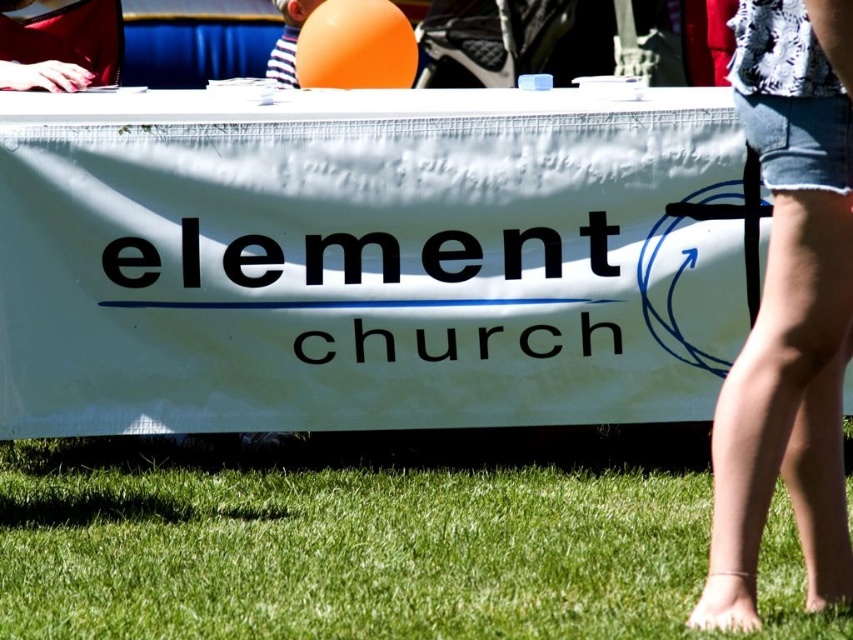
Question: Which point is closer to the camera?

Choices:
 (A) green grass at lower center
 (B) denim shorts at lower right

Answer: (B)

Question: Is green grass at lower center closer to camera compared to denim shorts at lower right?

Choices:
 (A) yes
 (B) no

Answer: (B)

Question: Which point is closer to the camera?

Choices:
 (A) green grass at lower center
 (B) denim shorts at lower right

Answer: (B)

Question: Does green grass at lower center have a greater width compared to denim shorts at lower right?

Choices:
 (A) yes
 (B) no

Answer: (A)

Question: Does green grass at lower center appear under denim shorts at lower right?

Choices:
 (A) yes
 (B) no

Answer: (A)